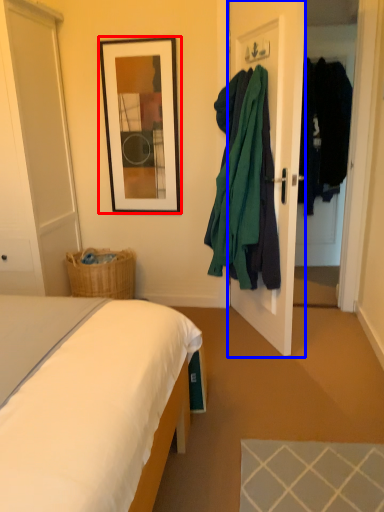
Question: Which object appears closest to the camera in this image, picture frame (highlighted by a red box) or door (highlighted by a blue box)?

Choices:
 (A) picture frame
 (B) door

Answer: (B)